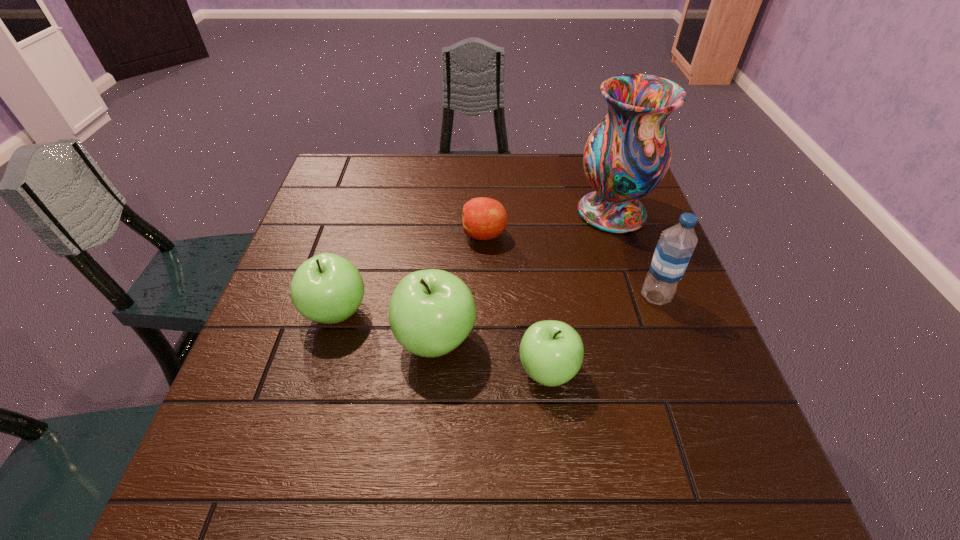
What are the coordinates of `vacant space located 0.120m on the label of the fifth shortest object` in the screenshot? It's located at (586, 296).

The width and height of the screenshot is (960, 540). Identify the location of vacant region located 0.350m on the label of the fifth shortest object. 483,296.

Find the location of a particular element. The height and width of the screenshot is (540, 960). free space located on the front of the shortest object is located at coordinates (486, 338).

Find the location of a particular element. The height and width of the screenshot is (540, 960). vacant space situated 0.100m on the front of the vase is located at coordinates (629, 265).

This screenshot has height=540, width=960. In order to click on object that is at the far edge in this screenshot , I will do `click(626, 157)`.

Identify the location of object present at the near edge. (551, 352).

Find the location of a particular element. The image size is (960, 540). object that is at the left edge is located at coordinates (327, 288).

Locate an element on the screen. This screenshot has height=540, width=960. water bottle present at the right edge is located at coordinates (674, 249).

Locate an element on the screen. Image resolution: width=960 pixels, height=540 pixels. vase situated at the right edge is located at coordinates (626, 157).

This screenshot has height=540, width=960. I want to click on object positioned at the far right corner, so click(x=626, y=157).